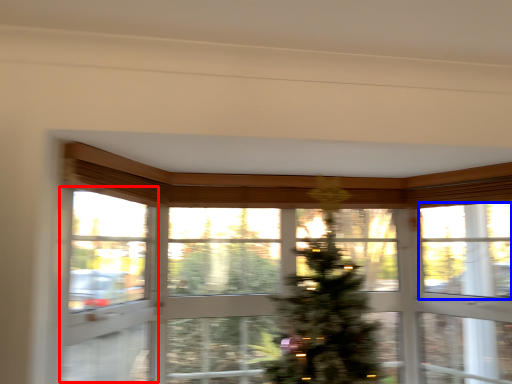
Question: Which object is closer to the camera taking this photo, screen door (highlighted by a red box) or window screen (highlighted by a blue box)?

Choices:
 (A) screen door
 (B) window screen

Answer: (A)